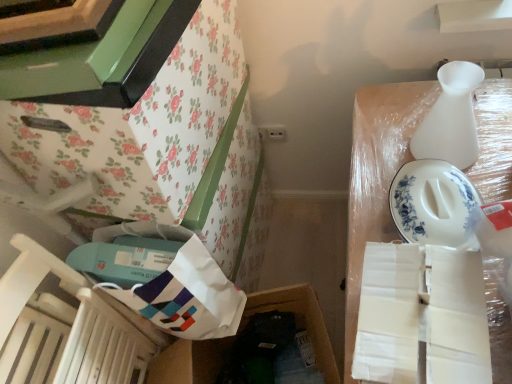
Question: From the image's perspective, is floral paper-covered cabinet at upper left positioned above or below white paper bag at lower left, positioned as the second wrapping paper in front-to-back order?

Choices:
 (A) above
 (B) below

Answer: (A)

Question: Would you say floral paper-covered cabinet at upper left is to the left or to the right of white paper bag at lower left, the first wrapping paper positioned from the left, in the picture?

Choices:
 (A) right
 (B) left

Answer: (B)

Question: Which is farther from the white matte wrapping paper at right, the 1th wrapping paper in the right-to-left sequence?

Choices:
 (A) wooden chair at lower left
 (B) white cardboard box at upper right, which is counted as the 1th storage box, starting from the right
 (C) white matte vase at upper right
 (D) floral paper-covered cabinet at upper left
 (E) white paper bag at lower left, which is counted as the 1th storage box, starting from the left

Answer: (A)

Question: Which object is the farthest from the wooden chair at lower left?

Choices:
 (A) white cardboard box at upper right, which is counted as the 1th storage box, starting from the right
 (B) white paper bag at lower left, positioned as the second wrapping paper in front-to-back order
 (C) white matte wrapping paper at right, the 1th wrapping paper in the right-to-left sequence
 (D) white matte vase at upper right
 (E) floral paper-covered cabinet at upper left

Answer: (D)